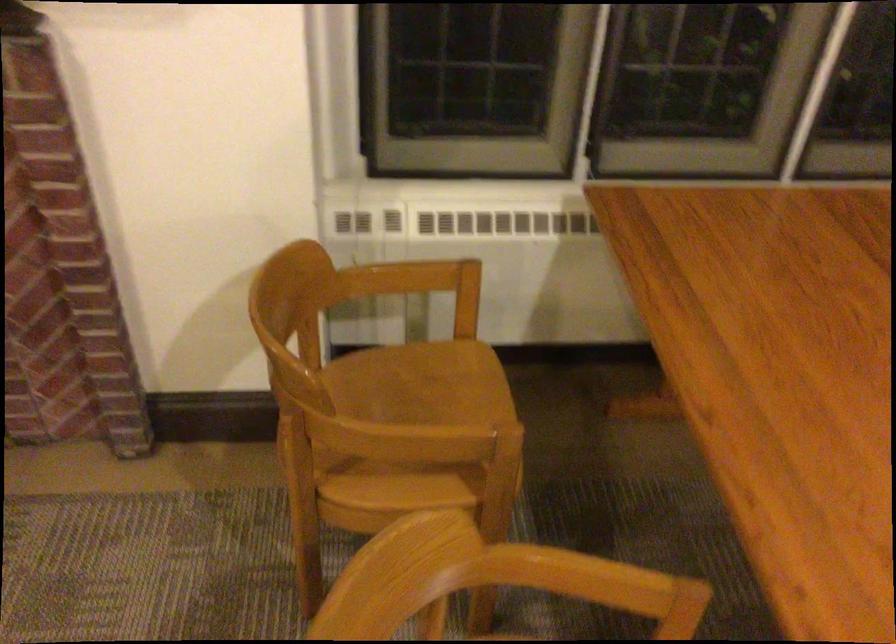
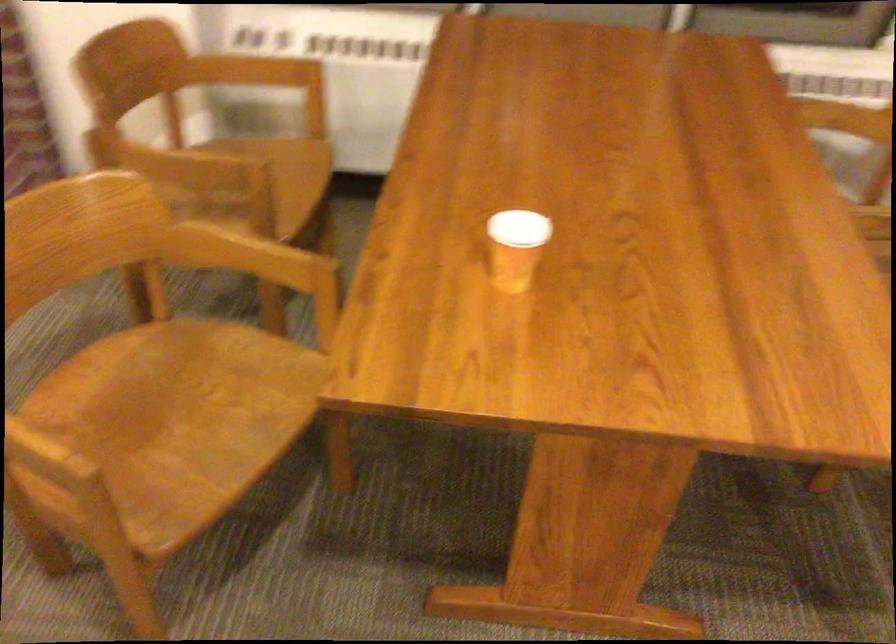
Where in the second image is the point corresponding to point 507,447 from the first image?

(252, 182)